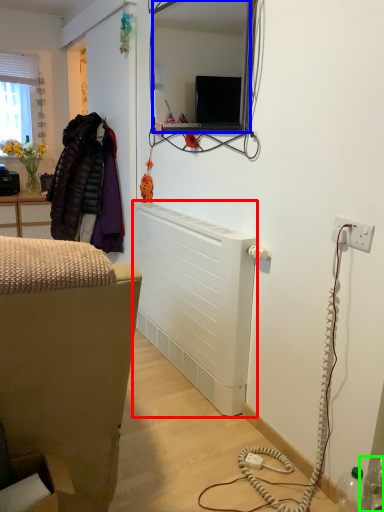
Question: Considering the real-world distances, which object is closest to radiator (highlighted by a red box)? mirror (highlighted by a blue box) or bottle (highlighted by a green box).

Choices:
 (A) mirror
 (B) bottle

Answer: (B)